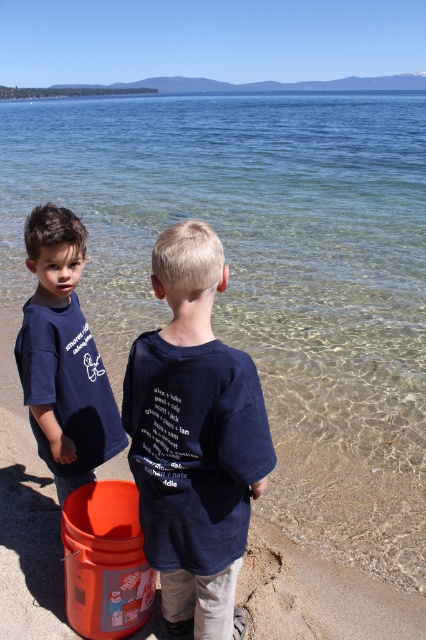
Question: Is navy blue t-shirt at center bigger than matte dark blue t-shirt at left?

Choices:
 (A) no
 (B) yes

Answer: (B)

Question: Which point is farther from the camera taking this photo?

Choices:
 (A) (74, 296)
 (B) (175, 392)

Answer: (A)

Question: Does navy blue t-shirt at center lie in front of matte dark blue t-shirt at left?

Choices:
 (A) yes
 (B) no

Answer: (A)

Question: Which object is closer to the camera taking this photo?

Choices:
 (A) matte dark blue t-shirt at left
 (B) navy blue t-shirt at center

Answer: (B)

Question: Is navy blue t-shirt at center bigger than matte dark blue t-shirt at left?

Choices:
 (A) yes
 (B) no

Answer: (A)

Question: Which point appears farthest from the camera in this image?

Choices:
 (A) (49, 387)
 (B) (216, 570)

Answer: (A)